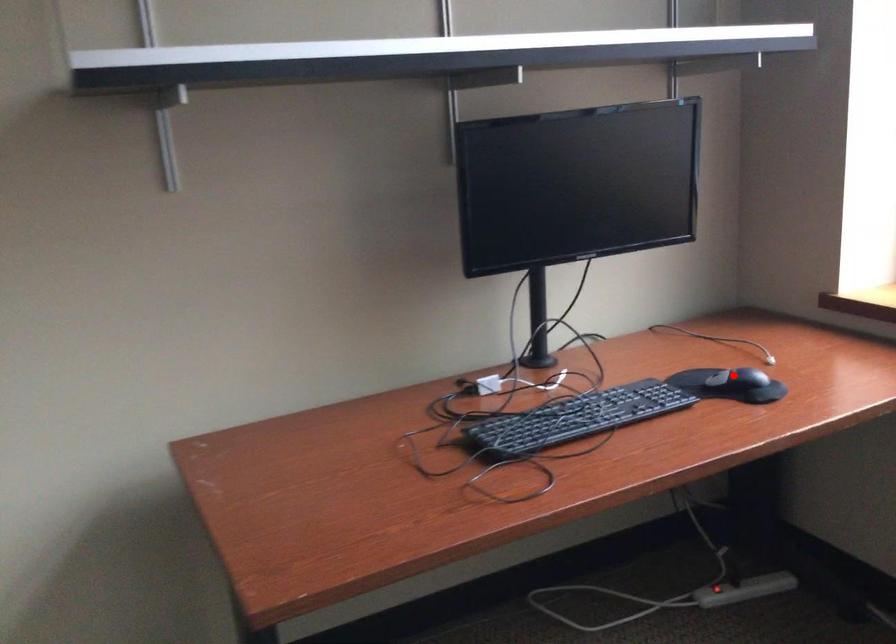
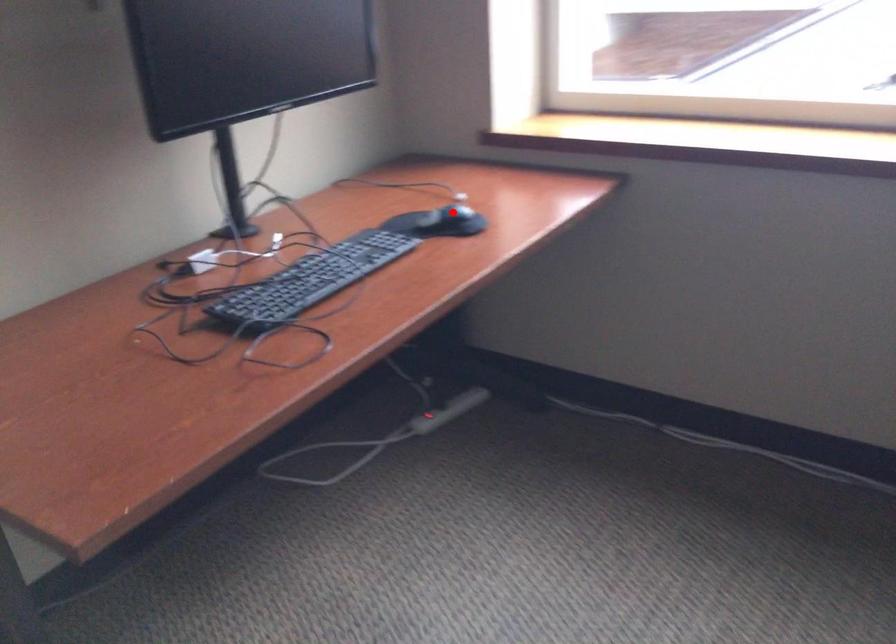
I am providing you with two images of the same scene from different viewpoints. A red point is marked on the first image and another point is marked on the second image. Are the points marked in image1 and image2 representing the same 3D position?

Yes